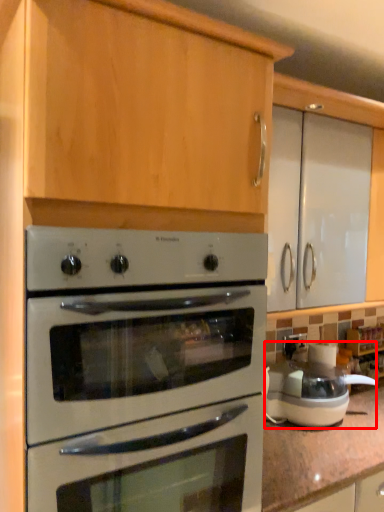
Question: From the image's perspective, where is appliance (annotated by the red box) located relative to oven?

Choices:
 (A) above
 (B) below

Answer: (B)